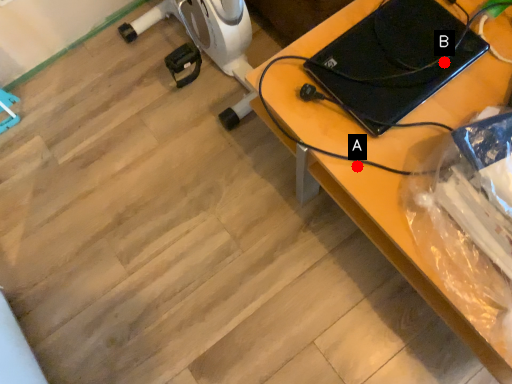
Question: Two points are circled on the image, labeled by A and B beside each circle. Which point appears farthest from the camera in this image?

Choices:
 (A) A is further
 (B) B is further

Answer: (B)